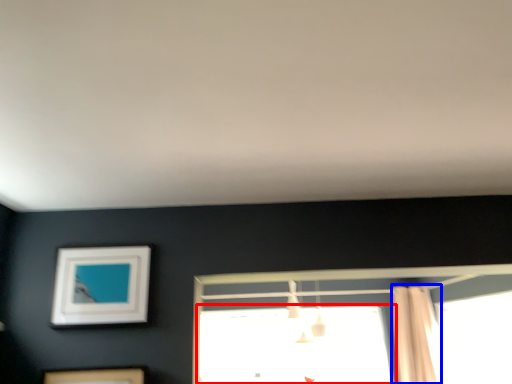
Question: Which object is closer to the camera taking this photo, window (highlighted by a red box) or shower curtain (highlighted by a blue box)?

Choices:
 (A) window
 (B) shower curtain

Answer: (B)